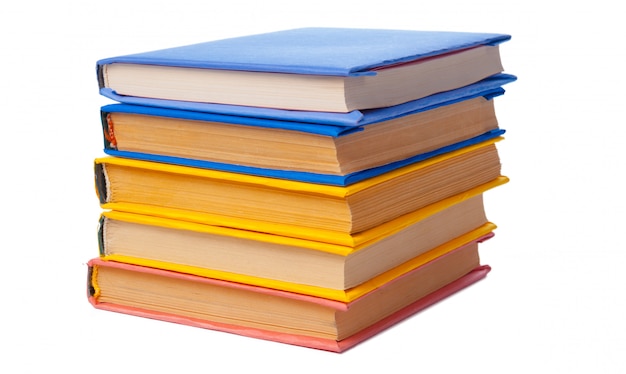
Identify the location of hardcover books. (329, 87), (319, 151), (316, 203), (329, 271), (316, 323).